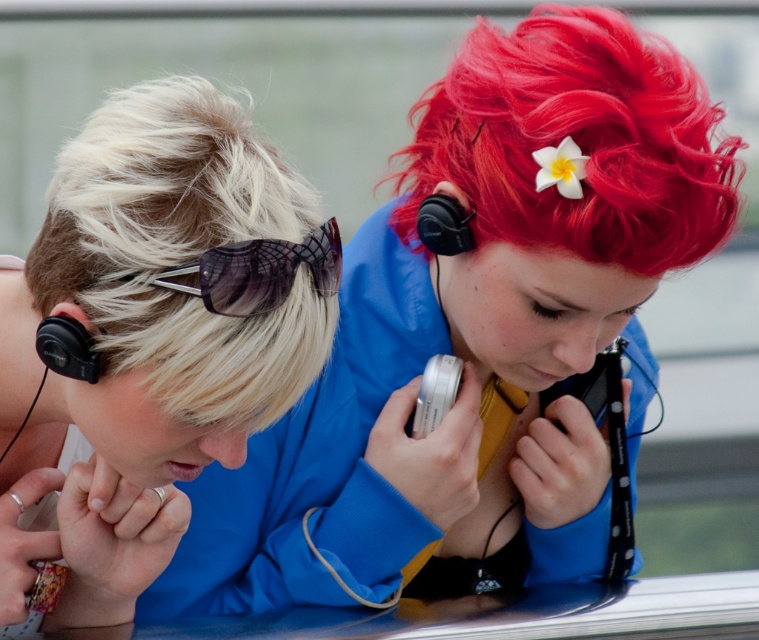
Question: Is transparent plastic goggles at upper left smaller than black matte earphone at upper center?

Choices:
 (A) no
 (B) yes

Answer: (A)

Question: Is vivid red hair at upper right wider than black matte earphone at upper center?

Choices:
 (A) no
 (B) yes

Answer: (B)

Question: Considering the real-world distances, which object is farthest from the black matte earphone at left?

Choices:
 (A) black matte headphones at left
 (B) black matte earphone at upper center
 (C) black matte earphone at upper right
 (D) transparent plastic goggles at upper left

Answer: (B)

Question: Among these points, which one is nearest to the camera?

Choices:
 (A) (465, 250)
 (B) (156, 298)
 (C) (61, 316)
 (D) (288, 253)

Answer: (B)

Question: Can you confirm if black matte earphone at left is positioned below black matte earphone at upper right?

Choices:
 (A) no
 (B) yes

Answer: (B)

Question: Which point is closer to the camera?

Choices:
 (A) transparent plastic goggles at upper left
 (B) vivid red hair at upper right
 (C) black matte earphone at upper center
 (D) black matte earphone at upper right

Answer: (A)